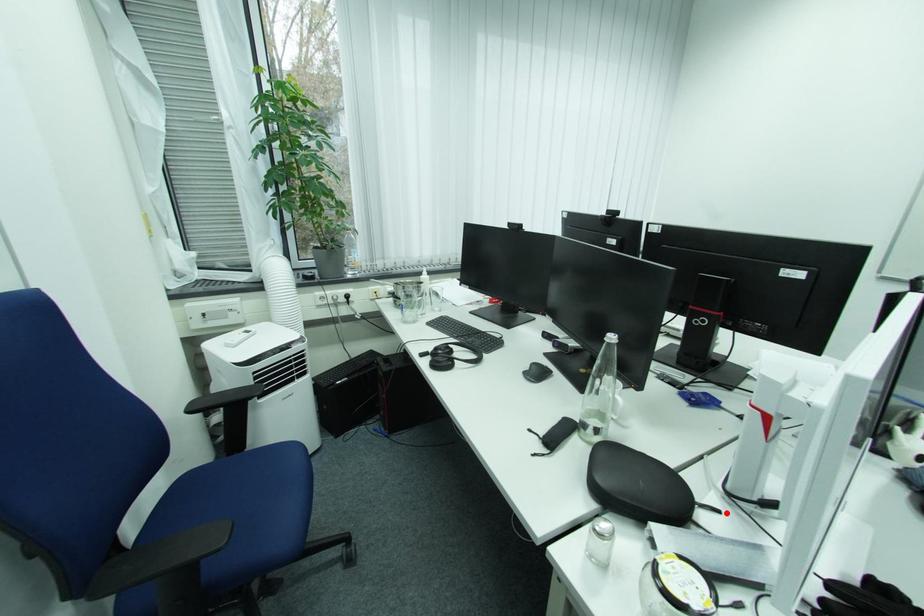
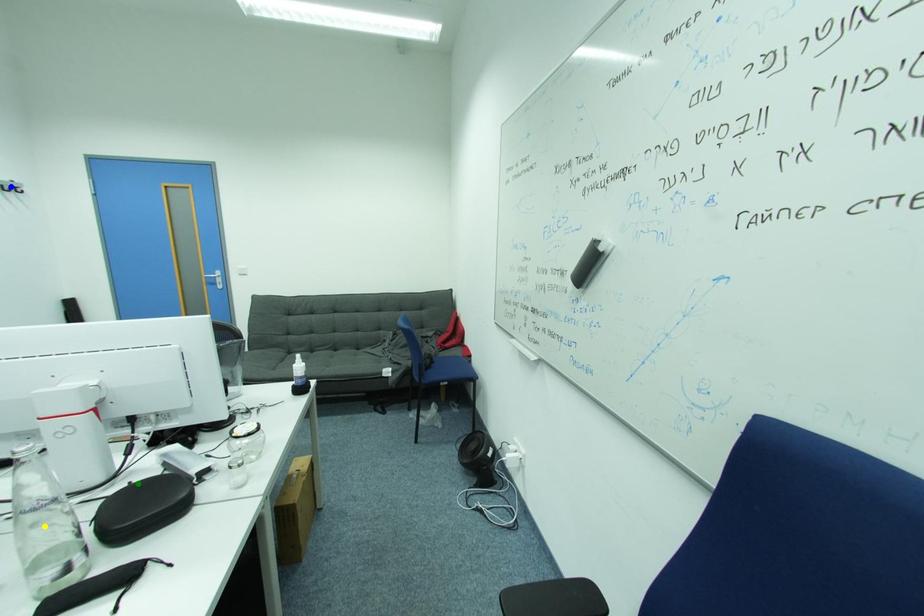
Question: I am providing you with two images of the same scene from different viewpoints. A red point is marked on the first image. You are given multiple points on the second image. Which point in image 2 represents the same 3d spot as the red point in image 1?

Choices:
 (A) yellow point
 (B) green point
 (C) blue point

Answer: (B)